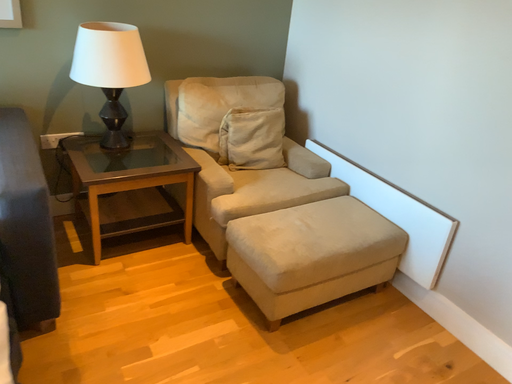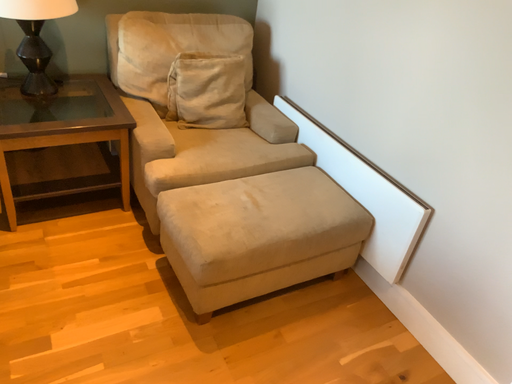
Question: Which way did the camera rotate in the video?

Choices:
 (A) rotated downward
 (B) rotated upward

Answer: (A)